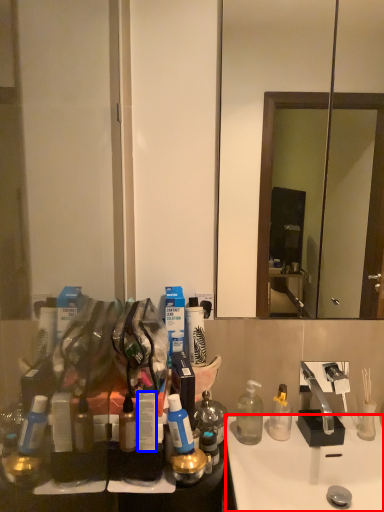
Question: Which of the following is the closest to the observer, sink (highlighted by a red box) or toiletry (highlighted by a blue box)?

Choices:
 (A) sink
 (B) toiletry

Answer: (B)